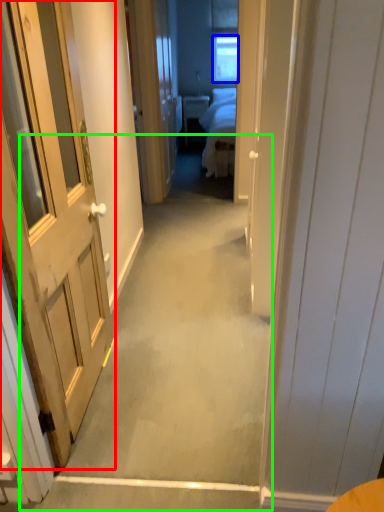
Question: Based on their relative distances, which object is farther from door (highlighted by a red box)? Choose from window (highlighted by a blue box) and path (highlighted by a green box).

Choices:
 (A) window
 (B) path

Answer: (A)